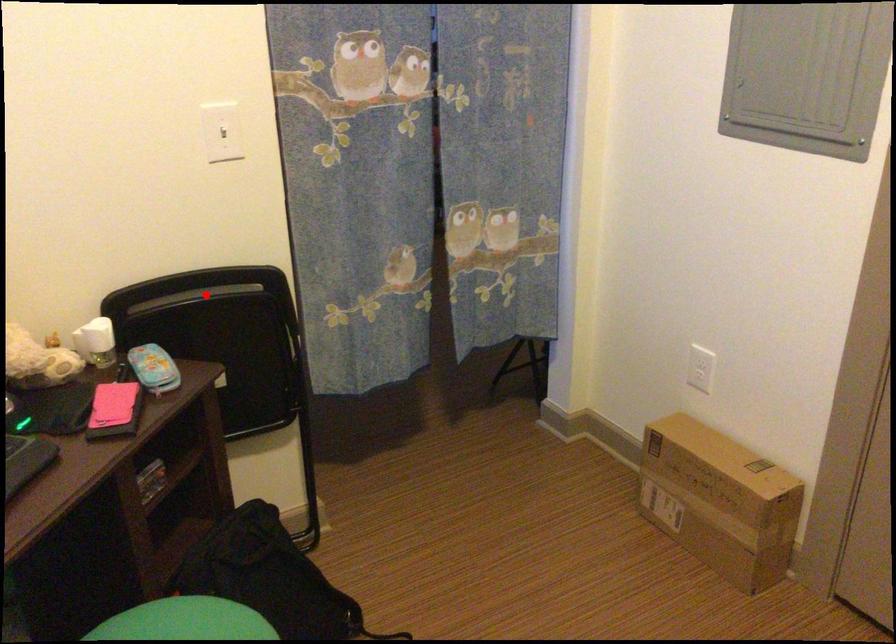
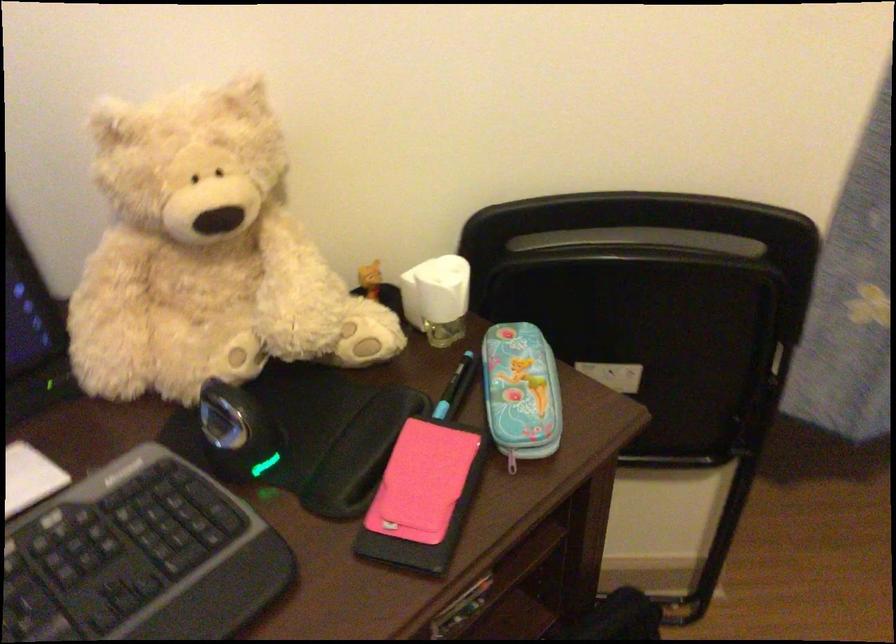
The point at the highlighted location is marked in the first image. Where is the corresponding point in the second image?

(642, 240)